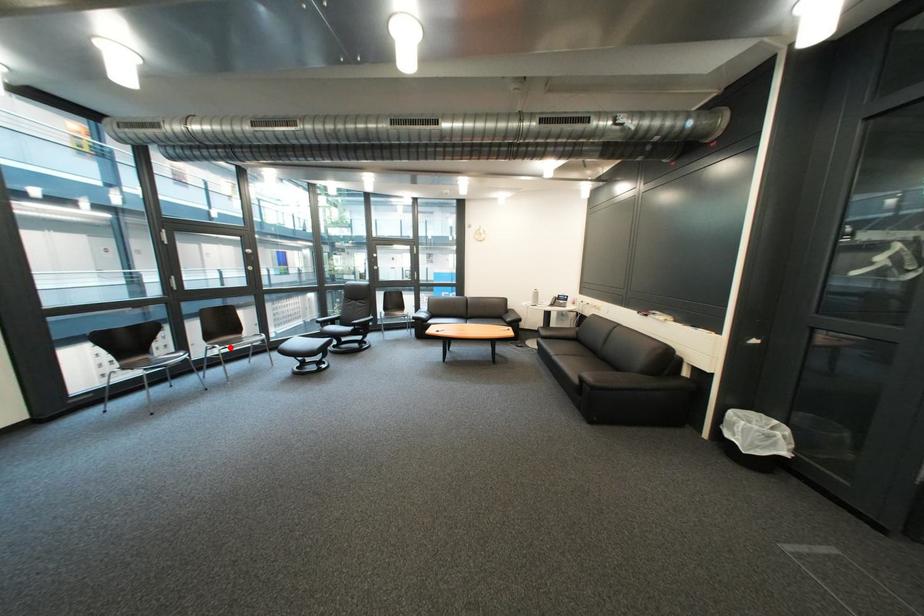
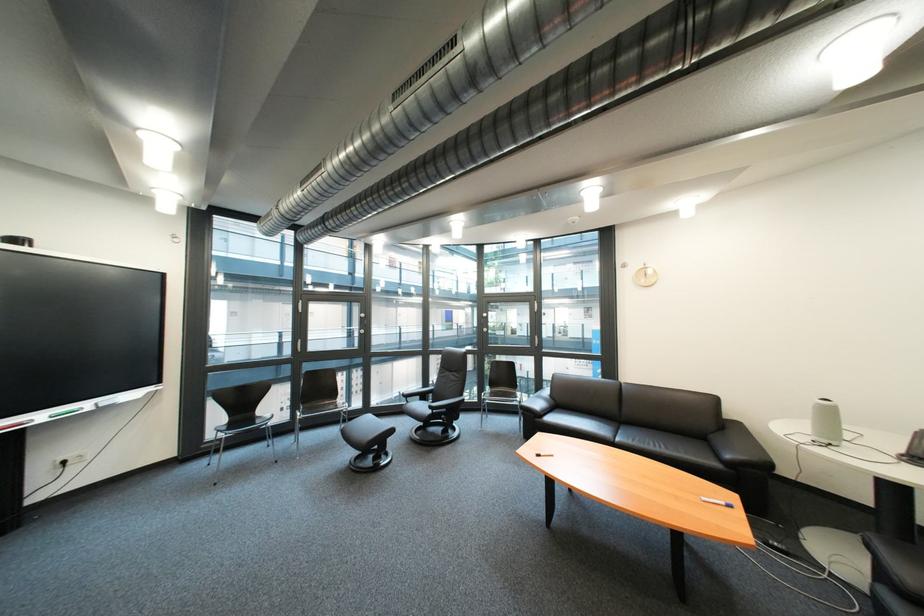
The point at the highlighted location is marked in the first image. Where is the corresponding point in the second image?

(312, 415)